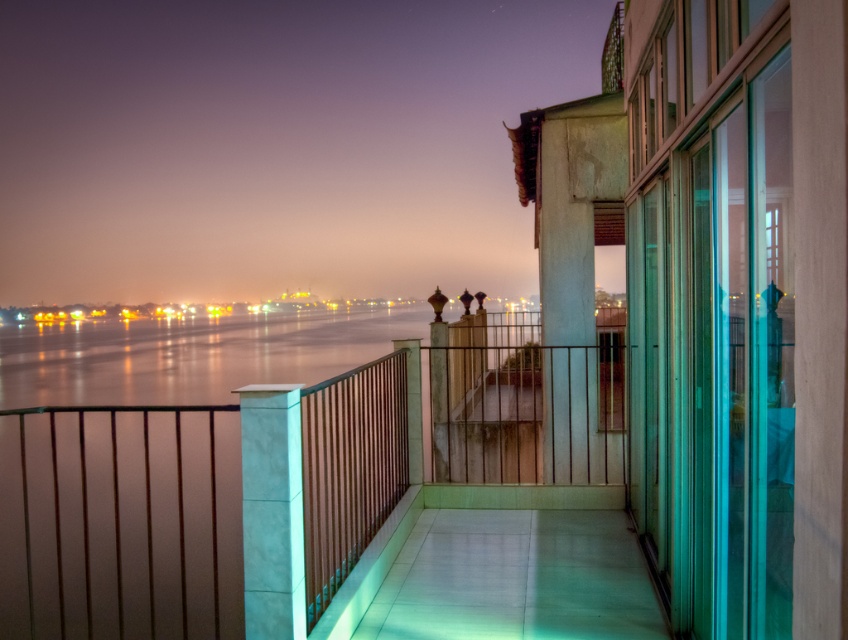
Question: Which point is closer to the camera?

Choices:
 (A) metallic railing at center
 (B) white marble pillar at center
 (C) glistening water at center

Answer: (B)

Question: Is metallic railing at center positioned before glistening water at center?

Choices:
 (A) no
 (B) yes

Answer: (B)

Question: Where is glistening water at center located in relation to white marble pillar at center in the image?

Choices:
 (A) right
 (B) left

Answer: (B)

Question: Is metallic railing at center thinner than white marble pillar at center?

Choices:
 (A) no
 (B) yes

Answer: (A)

Question: Among these objects, which one is nearest to the camera?

Choices:
 (A) glistening water at center
 (B) white marble pillar at center

Answer: (B)

Question: Considering the real-world distances, which object is closest to the glistening water at center?

Choices:
 (A) white marble pillar at center
 (B) metallic railing at center

Answer: (B)